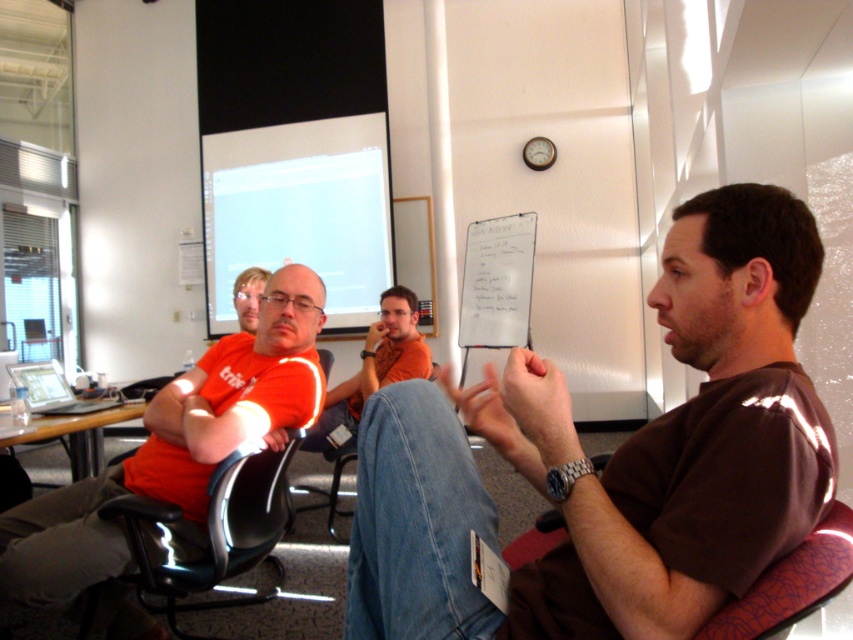
Who is lower down, orange t-shirt at left or whiteboard at center?

orange t-shirt at left

Can you confirm if orange t-shirt at left is positioned below whiteboard at center?

Yes.

What do you see at coordinates (177, 449) in the screenshot?
I see `orange t-shirt at left` at bounding box center [177, 449].

Where is `orange t-shirt at left`? orange t-shirt at left is located at coordinates (177, 449).

You are a GUI agent. You are given a task and a screenshot of the screen. Output one action in this format:
    pyautogui.click(x=<x>, y=<y>)
    Task: Click on the brown cotton shirt at center
    This screenshot has height=640, width=853.
    Given the screenshot: What is the action you would take?
    click(x=613, y=460)

Based on the photo, between brown cotton shirt at center and orange t-shirt at left, which one appears on the left side from the viewer's perspective?

Positioned to the left is orange t-shirt at left.

The height and width of the screenshot is (640, 853). What do you see at coordinates (613, 460) in the screenshot? I see `brown cotton shirt at center` at bounding box center [613, 460].

Identify the location of brown cotton shirt at center. (613, 460).

Measure the distance between point (x=277, y=492) and camera.

Point (x=277, y=492) is 2.06 meters away from camera.

Describe the element at coordinates (215, 529) in the screenshot. This screenshot has width=853, height=640. I see `black leather chair at left` at that location.

Is point (262, 461) more distant than point (407, 310)?

No, it is in front of (407, 310).

In order to click on black leather chair at left in this screenshot , I will do `click(215, 529)`.